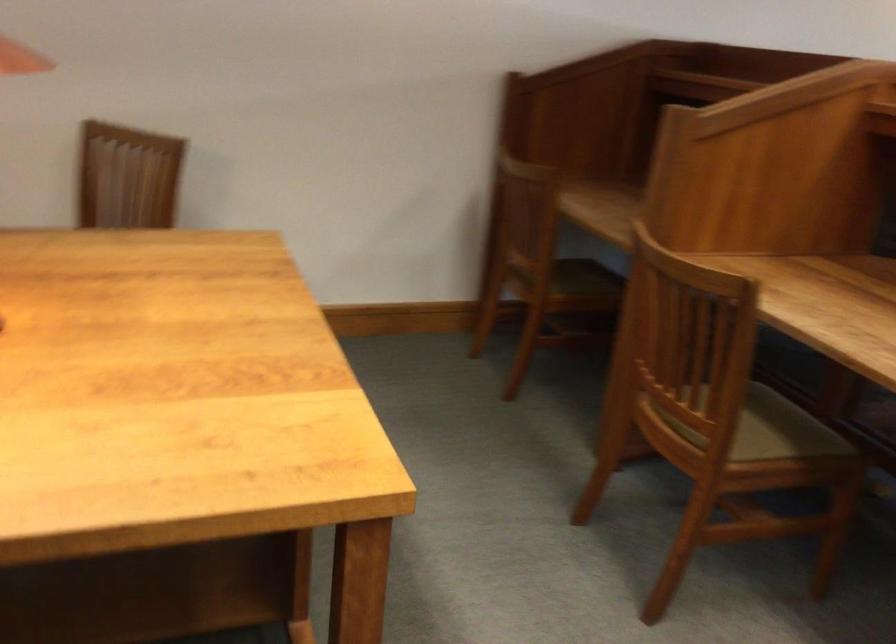
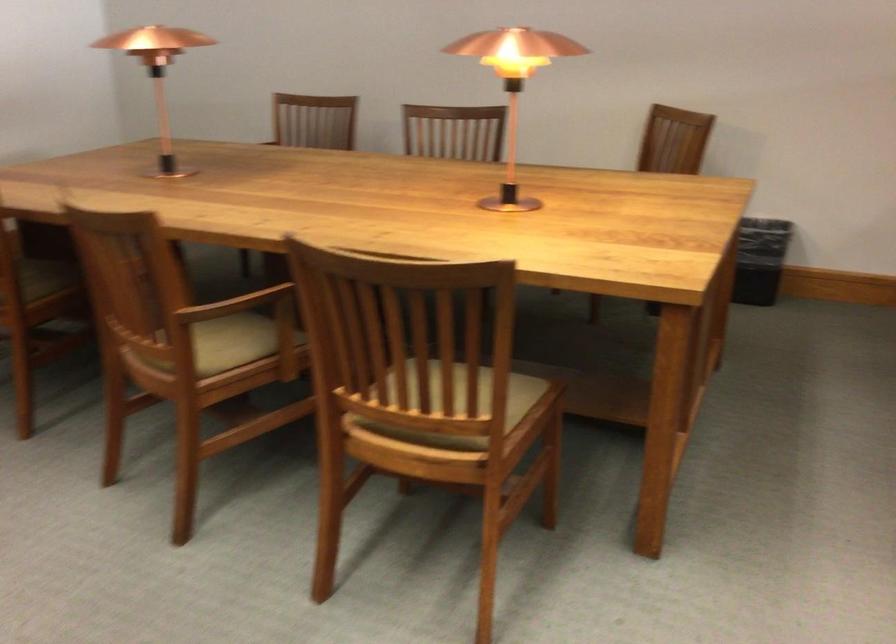
Question: The camera is either moving clockwise (left) or counter-clockwise (right) around the object. The first image is from the beginning of the video and the second image is from the end. Is the camera moving left or right when shooting the video?

Choices:
 (A) Left
 (B) Right

Answer: (B)